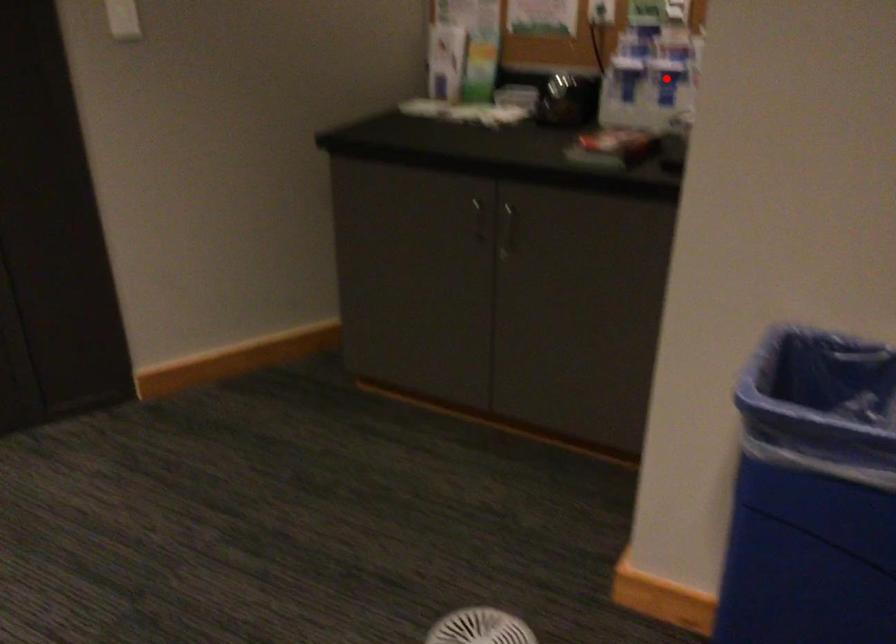
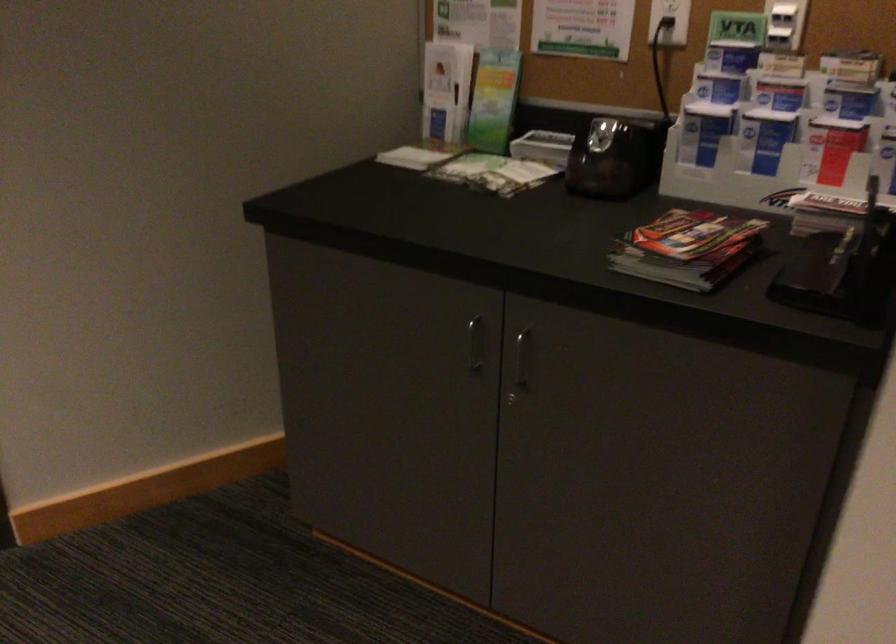
In the second image, find the point that corresponds to the highlighted location in the first image.

(764, 138)